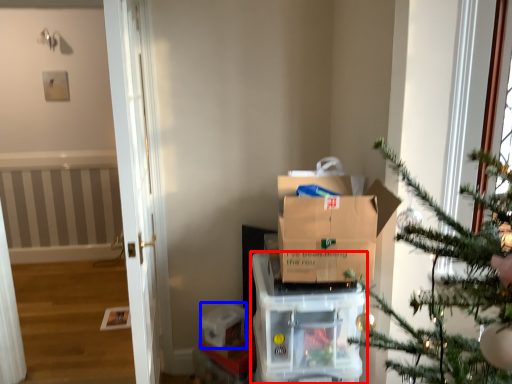
Question: Which object appears closest to the camera in this image, appliance (highlighted by a red box) or storage box (highlighted by a blue box)?

Choices:
 (A) appliance
 (B) storage box

Answer: (A)